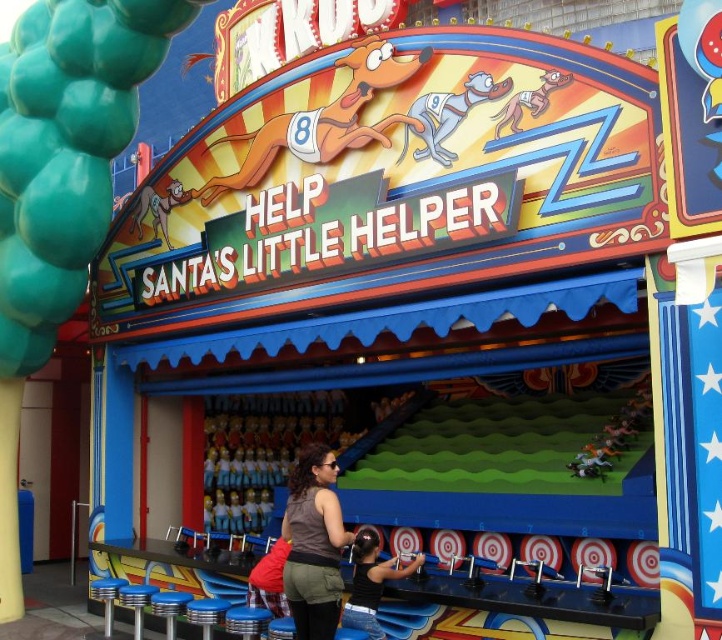
You are a carnival visitor holding a prize ticket and standing in front of the Santa Little Helper booth. You see the brown fabric shirt at center and the gray fabric dog at center. Which object should you look to your left to find?

The brown fabric shirt at center is to the left of the gray fabric dog at center, so you should look to your left to find the brown fabric shirt at center.